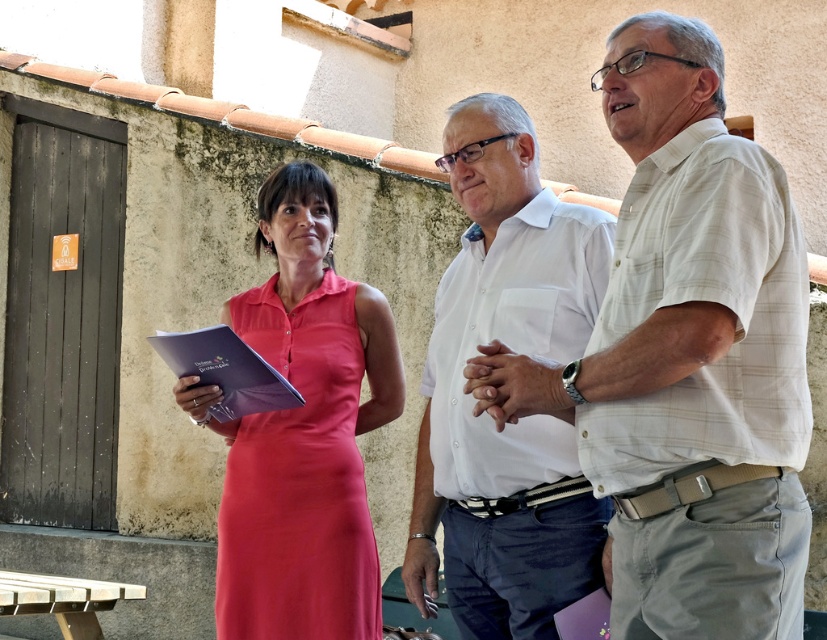
Between white cotton shirt at center and satin pink dress at center, which one has more height?

white cotton shirt at center

Can you confirm if white cotton shirt at center is thinner than satin pink dress at center?

No.

Is point (541, 490) farther from viewer compared to point (319, 412)?

No, it is in front of (319, 412).

In order to click on white cotton shirt at center in this screenshot , I will do `click(519, 420)`.

Does white plaid shirt at center have a lesser height compared to white cotton shirt at center?

Yes.

In the scene shown: Can you confirm if white plaid shirt at center is wider than white cotton shirt at center?

Indeed, white plaid shirt at center has a greater width compared to white cotton shirt at center.

Is point (698, 90) positioned before point (572, 481)?

Yes, it is.

Identify the location of white plaid shirt at center. (687, 356).

Can you confirm if white plaid shirt at center is thinner than satin pink dress at center?

In fact, white plaid shirt at center might be wider than satin pink dress at center.

Can you confirm if white plaid shirt at center is taller than satin pink dress at center?

Correct, white plaid shirt at center is much taller as satin pink dress at center.

Identify the location of white plaid shirt at center. This screenshot has width=827, height=640. (687, 356).

Where is `white plaid shirt at center`? The width and height of the screenshot is (827, 640). white plaid shirt at center is located at coordinates (687, 356).